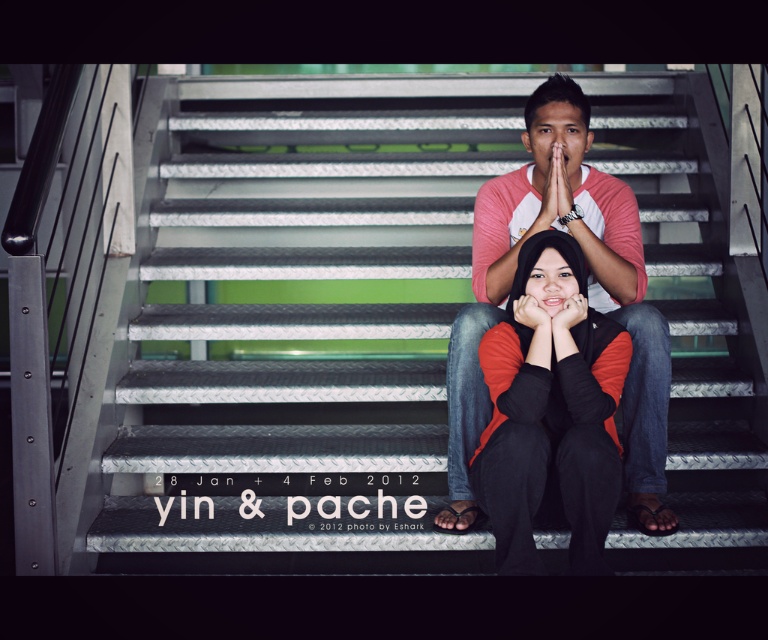
Which of these two, metallic stairwell at center or matte orange sweater at center, stands shorter?

matte orange sweater at center is shorter.

Who is more distant from viewer, (194, 196) or (520, 480)?

The point (194, 196) is more distant.

The height and width of the screenshot is (640, 768). I want to click on metallic stairwell at center, so click(303, 326).

Which is behind, point (452, 348) or point (563, 237)?

The point (452, 348) is more distant.

Can you confirm if matte pink shirt at center is positioned above matte orange sweater at center?

Yes, matte pink shirt at center is above matte orange sweater at center.

What do you see at coordinates (588, 298) in the screenshot? I see `matte pink shirt at center` at bounding box center [588, 298].

Where is `matte pink shirt at center`? matte pink shirt at center is located at coordinates (588, 298).

Does metallic stairwell at center have a lesser height compared to matte pink shirt at center?

No, metallic stairwell at center is not shorter than matte pink shirt at center.

Between metallic stairwell at center and matte pink shirt at center, which one has more height?

metallic stairwell at center

Find the location of a particular element. The width and height of the screenshot is (768, 640). metallic stairwell at center is located at coordinates (303, 326).

This screenshot has width=768, height=640. I want to click on metallic stairwell at center, so click(x=303, y=326).